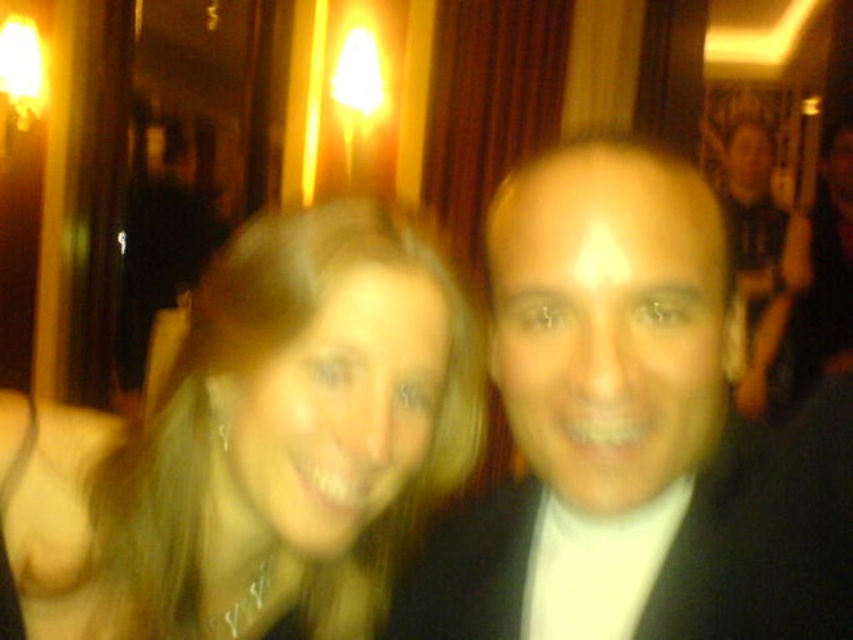
You are a photographer trying to capture a clear photo of the blonde hair at center. The two people in the foreground are moving slightly. How far apart are the two people in the foreground?

The two people in the foreground are 21.69 inches apart.

You are a photographer at the event and want to adjust the lighting so that the blonde hair at center and the black satin suit at upper right are both well illuminated. Based on their positions, which object should you adjust the light towards first?

The blonde hair at center should be adjusted first since it is positioned to the left of the black satin suit at upper right, so focusing on its placement ensures both receive adequate light.

You are at a social event and want to take a photo of the blonde hair at center and the black satin suit at upper right. Which object is positioned lower in the frame?

The blonde hair at center is located below the black satin suit at upper right, so the blonde hair at center is positioned lower in the frame.